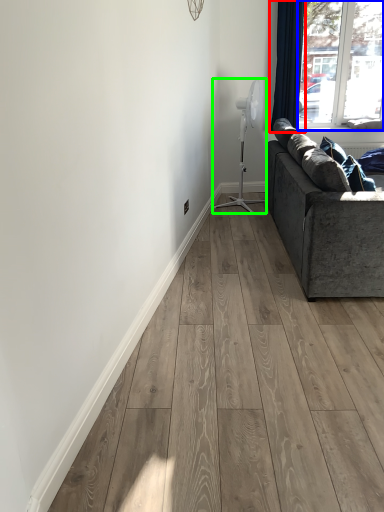
Question: Based on their relative distances, which object is farther from curtain (highlighted by a red box)? Choose from window (highlighted by a blue box) and fan (highlighted by a green box).

Choices:
 (A) window
 (B) fan

Answer: (A)